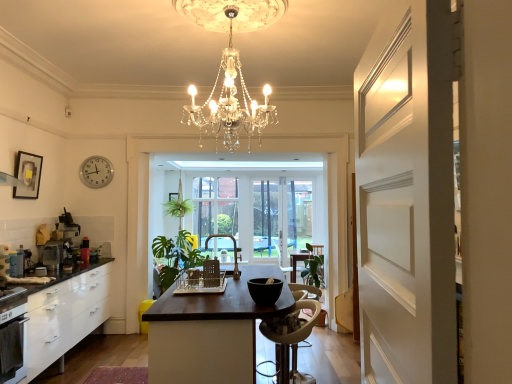
Question: Is dark brown wood table at center placed right next to matte gold faucet at center, arranged as the 2th chair when viewed from the left?

Choices:
 (A) yes
 (B) no

Answer: (B)

Question: Is dark brown wood table at center thinner than matte gold faucet at center, placed as the 1th chair when sorted from back to front?

Choices:
 (A) yes
 (B) no

Answer: (B)

Question: Does dark brown wood table at center have a smaller size compared to matte gold faucet at center, positioned as the 1th chair in top-to-bottom order?

Choices:
 (A) yes
 (B) no

Answer: (B)

Question: Considering the relative positions of dark brown wood table at center and matte gold faucet at center, the 3th chair from the front, in the image provided, is dark brown wood table at center behind matte gold faucet at center, the 3th chair from the front,?

Choices:
 (A) yes
 (B) no

Answer: (B)

Question: Considering the relative sizes of dark brown wood table at center and matte gold faucet at center, marked as the 2th chair in a right-to-left arrangement, in the image provided, is dark brown wood table at center shorter than matte gold faucet at center, marked as the 2th chair in a right-to-left arrangement,?

Choices:
 (A) no
 (B) yes

Answer: (A)

Question: Does dark brown wood table at center turn towards matte gold faucet at center, the 3th chair in the bottom-to-top sequence?

Choices:
 (A) no
 (B) yes

Answer: (A)

Question: Can you confirm if green leafy plant at center is wider than matte black picture frame at upper left?

Choices:
 (A) no
 (B) yes

Answer: (B)

Question: Can matte black picture frame at upper left be found inside green leafy plant at center?

Choices:
 (A) no
 (B) yes

Answer: (A)

Question: Is green leafy plant at center bigger than matte black picture frame at upper left?

Choices:
 (A) yes
 (B) no

Answer: (A)

Question: Is the position of green leafy plant at center more distant than that of matte black picture frame at upper left?

Choices:
 (A) no
 (B) yes

Answer: (B)

Question: Does green leafy plant at center have a lesser width compared to matte black picture frame at upper left?

Choices:
 (A) no
 (B) yes

Answer: (A)

Question: Does green leafy plant at center have a lesser height compared to matte black picture frame at upper left?

Choices:
 (A) yes
 (B) no

Answer: (B)

Question: Considering the relative sizes of metallic silver toaster at left, the 3th appliance when ordered from right to left, and matte gold faucet at center, placed as the 1th chair when sorted from back to front, in the image provided, is metallic silver toaster at left, the 3th appliance when ordered from right to left, smaller than matte gold faucet at center, placed as the 1th chair when sorted from back to front,?

Choices:
 (A) yes
 (B) no

Answer: (A)